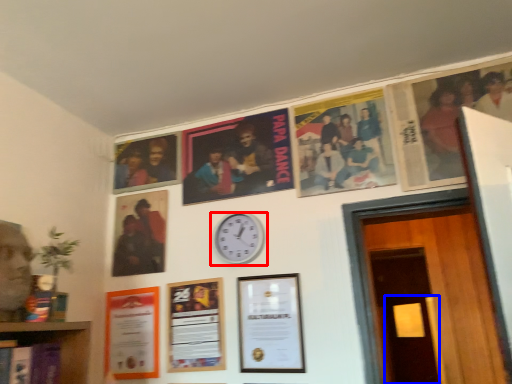
Question: Which object appears farthest to the camera in this image, wall clock (highlighted by a red box) or door (highlighted by a blue box)?

Choices:
 (A) wall clock
 (B) door

Answer: (B)